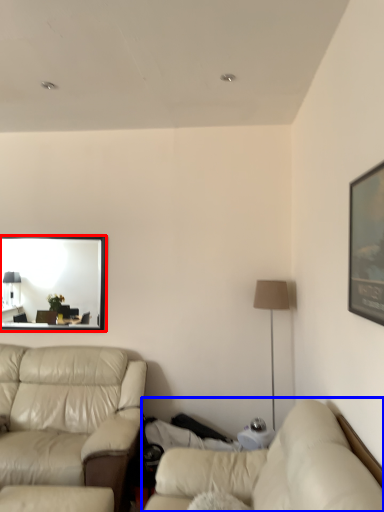
Question: Which object appears farthest to the camera in this image, mirror (highlighted by a red box) or studio couch (highlighted by a blue box)?

Choices:
 (A) mirror
 (B) studio couch

Answer: (A)